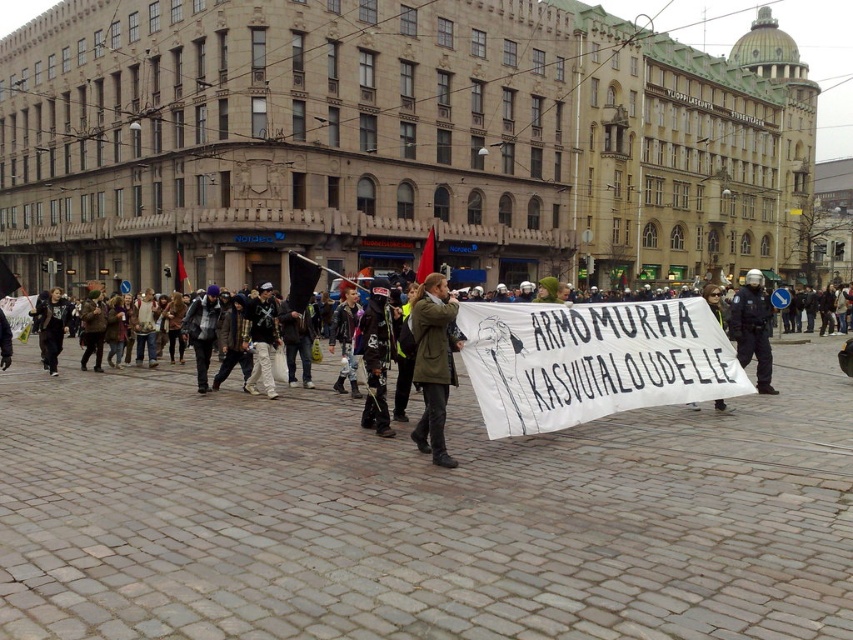
Which of these two, green matte coat at center or matte black helmet at center, stands taller?

With more height is matte black helmet at center.

In the scene shown: Is the position of green matte coat at center more distant than that of matte black helmet at center?

No, it is not.

At what (x,y) coordinates should I click in order to perform the action: click on green matte coat at center. Please return your answer as a coordinate pair (x, y). Looking at the image, I should click on [433, 364].

This screenshot has width=853, height=640. Find the location of `green matte coat at center`. green matte coat at center is located at coordinates (433, 364).